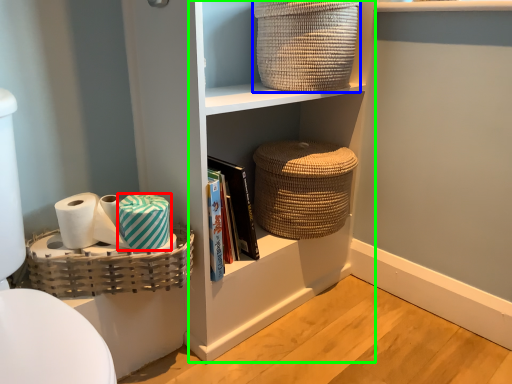
Question: Which is nearer to the material (highlighted by a red box)? basket (highlighted by a blue box) or cabinet (highlighted by a green box).

Choices:
 (A) basket
 (B) cabinet

Answer: (B)